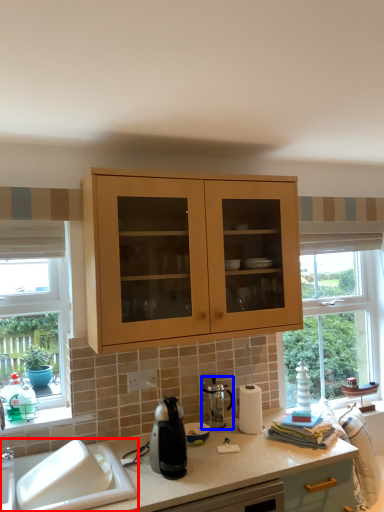
Question: Which of the following is the closest to the observer, sink (highlighted by a red box) or appliance (highlighted by a blue box)?

Choices:
 (A) sink
 (B) appliance

Answer: (A)